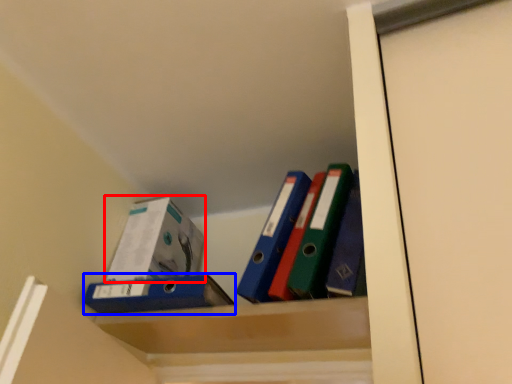
Question: Which of the following is the farthest to the observer, box (highlighted by a red box) or paperback book (highlighted by a blue box)?

Choices:
 (A) box
 (B) paperback book

Answer: (A)